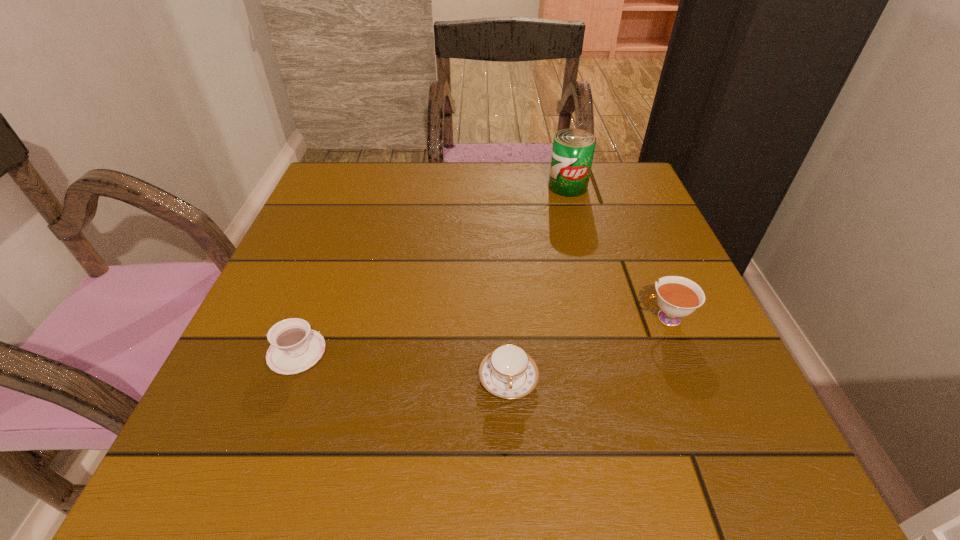
I want to click on can, so click(573, 149).

Identify the location of the farthest object. The image size is (960, 540). (573, 149).

Locate an element on the screen. The image size is (960, 540). the rightmost object is located at coordinates (677, 297).

Where is `the tallest teacup`? The height and width of the screenshot is (540, 960). the tallest teacup is located at coordinates (677, 297).

What are the coordinates of `the second teacup from right to left` in the screenshot? It's located at (508, 372).

Locate an element on the screen. The image size is (960, 540). the leftmost object is located at coordinates (295, 347).

Locate an element on the screen. free spot located on the front of the can is located at coordinates (587, 255).

Identify the location of vacant space located on the side of the third shortest object with the handle. (590, 318).

I want to click on vacant space positioned 0.180m on the side of the third shortest object with the handle, so click(x=540, y=318).

Locate an element on the screen. vacant space located on the side of the third shortest object with the handle is located at coordinates (513, 318).